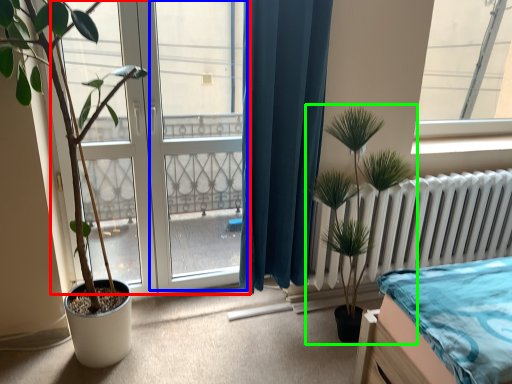
Question: Estimate the real-world distances between objects in this image. Which object is closer to bay window (highlighted by a red box), screen door (highlighted by a blue box) or houseplant (highlighted by a green box)?

Choices:
 (A) screen door
 (B) houseplant

Answer: (A)